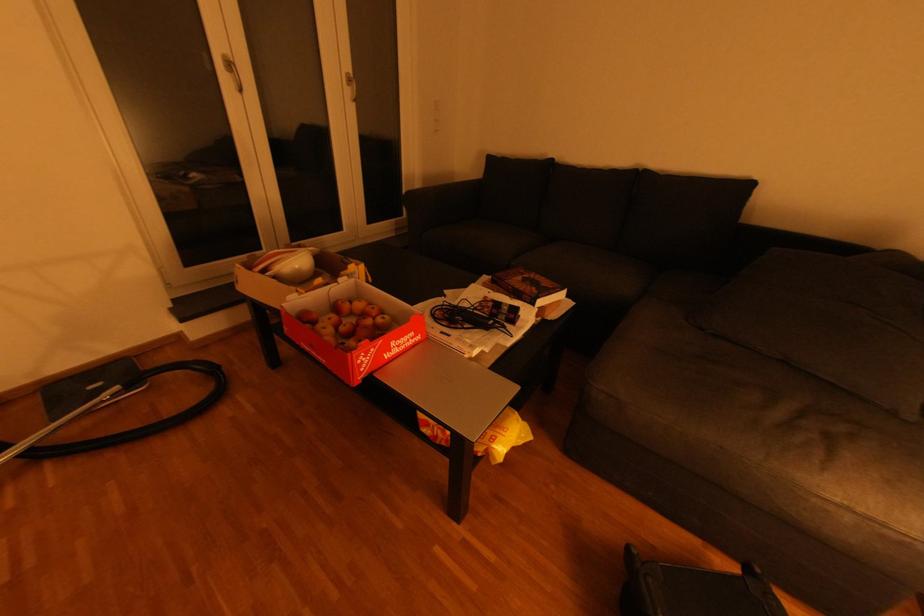
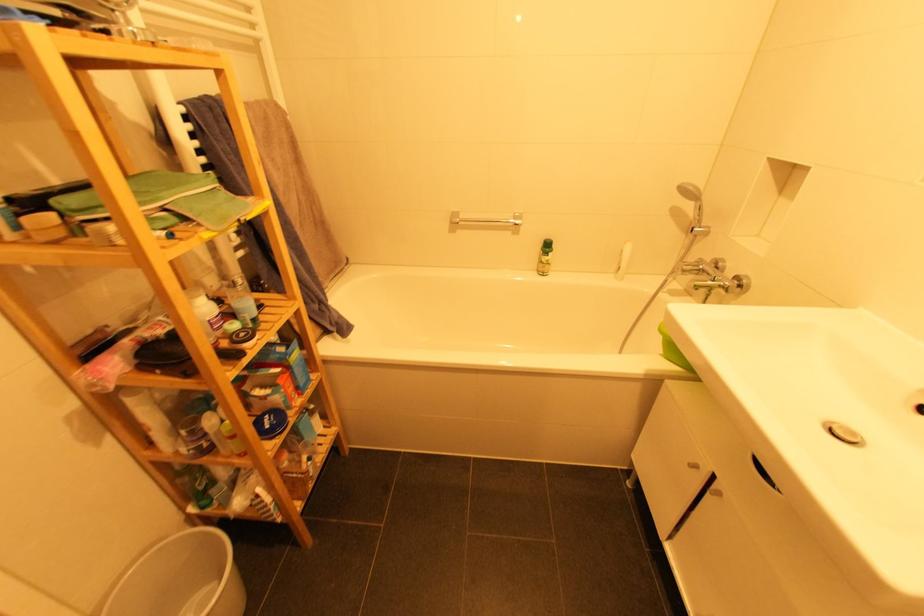
Question: I am providing you with two images of the same scene from different viewpoints. Which of the following objects are not visible in image2?

Choices:
 (A) sofa armrest
 (B) metal towel rack
 (C) bottle pump top
 (D) small ceramic cup

Answer: (A)